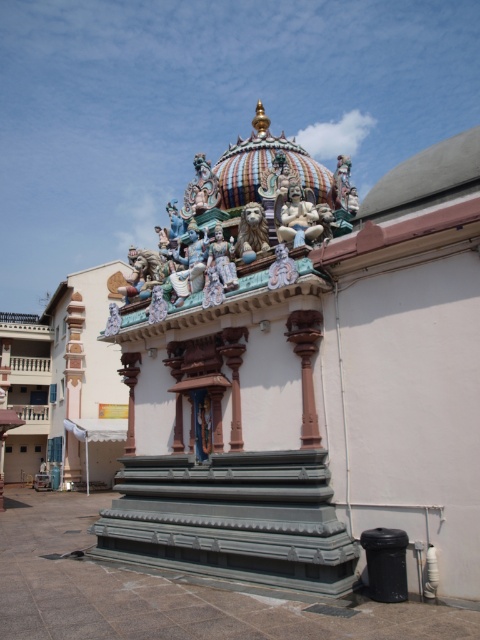
Question: Is polished white statue at center thinner than matte gold lion at center?

Choices:
 (A) no
 (B) yes

Answer: (A)

Question: Which object is closer to the camera taking this photo?

Choices:
 (A) matte gold lion at center
 (B) polished white statue at center

Answer: (B)

Question: Which point is closer to the camera taking this photo?

Choices:
 (A) (240, 244)
 (B) (285, 230)

Answer: (B)

Question: Does polished white statue at center come behind matte gold lion at center?

Choices:
 (A) yes
 (B) no

Answer: (B)

Question: Where is polished white statue at center located in relation to matte gold lion at center in the image?

Choices:
 (A) left
 (B) right

Answer: (B)

Question: Which of the following is the farthest from the observer?

Choices:
 (A) (241, 246)
 (B) (295, 186)

Answer: (A)